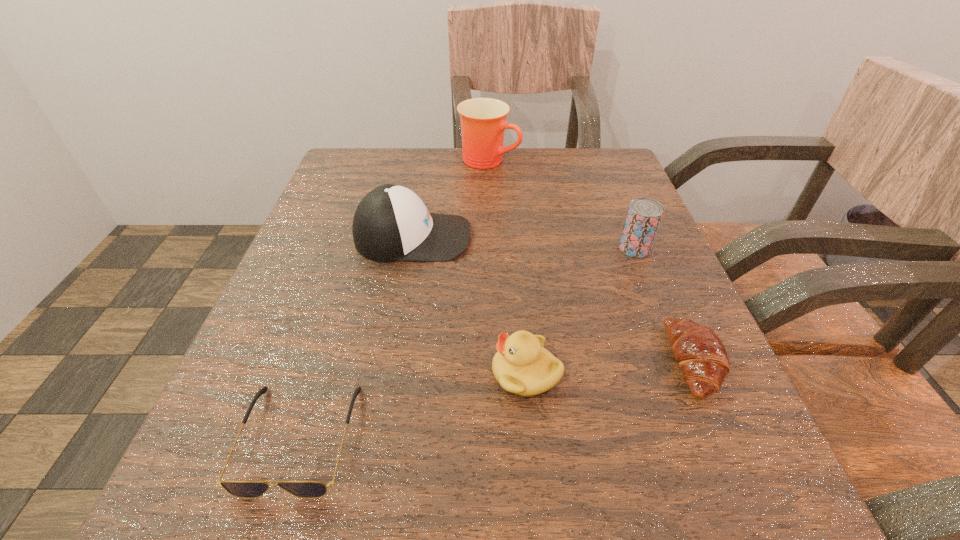
The width and height of the screenshot is (960, 540). I want to click on the tallest object, so click(x=483, y=120).

Find the location of a particular element. the farthest object is located at coordinates pos(483,120).

Where is `cap`? The height and width of the screenshot is (540, 960). cap is located at coordinates (391, 223).

Identify the location of the third tallest object. The width and height of the screenshot is (960, 540). (644, 215).

Where is `duckling`? This screenshot has height=540, width=960. duckling is located at coordinates (522, 366).

Locate an element on the screen. This screenshot has height=540, width=960. crescent roll is located at coordinates (700, 353).

This screenshot has width=960, height=540. What are the coordinates of `sunglasses` in the screenshot? It's located at (242, 489).

Image resolution: width=960 pixels, height=540 pixels. Identify the location of free region located on the front of the farthest object. (491, 226).

Image resolution: width=960 pixels, height=540 pixels. Find the location of `vacant position located 0.150m on the front panel of the cap`. vacant position located 0.150m on the front panel of the cap is located at coordinates (551, 237).

I want to click on free region located 0.290m on the back of the fourth shortest object, so click(600, 161).